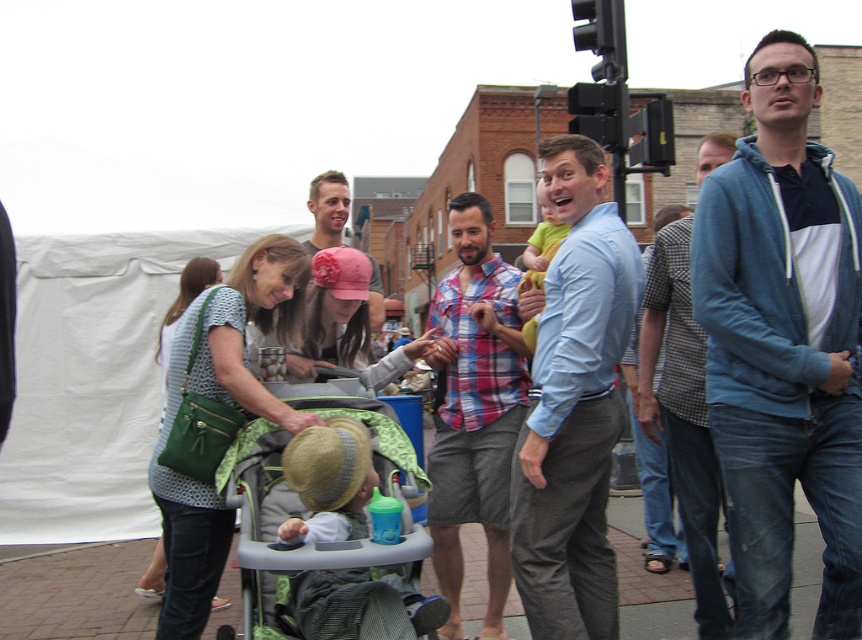
Question: Can you confirm if blue fleece jacket at upper right is positioned to the left of light blue shirt at center?

Choices:
 (A) no
 (B) yes

Answer: (A)

Question: Which object appears farthest from the camera in this image?

Choices:
 (A) light blue shirt at center
 (B) blue hoodie at right
 (C) blue fleece jacket at upper right
 (D) green fabric stroller at center

Answer: (B)

Question: Does blue fleece jacket at upper right come behind green fabric stroller at center?

Choices:
 (A) yes
 (B) no

Answer: (A)

Question: Is the position of plaid shirt at center more distant than that of blue hoodie at right?

Choices:
 (A) yes
 (B) no

Answer: (A)

Question: Which point is closer to the camera taking this photo?

Choices:
 (A) (489, 372)
 (B) (742, 326)
 (C) (258, 458)
 (D) (673, 316)

Answer: (B)

Question: Which point is closer to the camera?

Choices:
 (A) blue hoodie at right
 (B) green fabric stroller at center
 (C) blue fleece jacket at upper right
 (D) light blue shirt at center

Answer: (B)